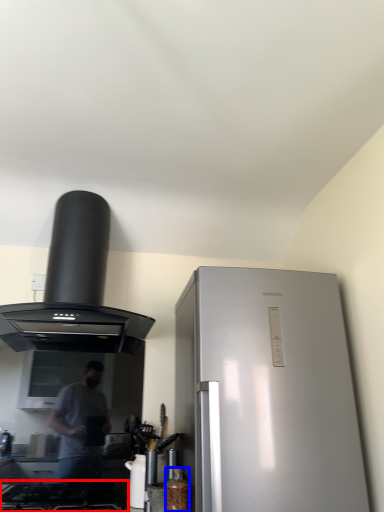
Question: Among these objects, which one is nearest to the camera, gas stove (highlighted by a red box) or bottle (highlighted by a blue box)?

Choices:
 (A) gas stove
 (B) bottle

Answer: (A)